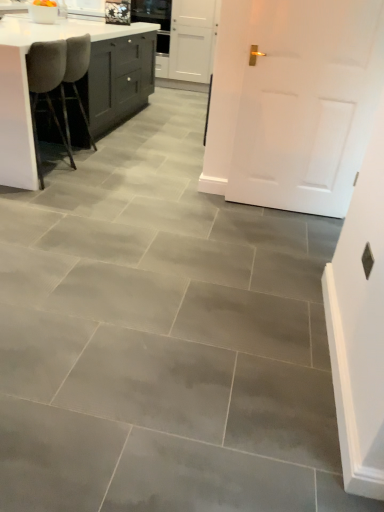
Question: Could you tell me if white matte door at center is turned towards white glossy countertop at upper left?

Choices:
 (A) no
 (B) yes

Answer: (A)

Question: Considering the relative sizes of white matte door at center and white glossy countertop at upper left in the image provided, is white matte door at center taller than white glossy countertop at upper left?

Choices:
 (A) no
 (B) yes

Answer: (B)

Question: Is white matte door at center directly adjacent to white glossy countertop at upper left?

Choices:
 (A) yes
 (B) no

Answer: (B)

Question: Is the depth of white matte door at center greater than that of white glossy countertop at upper left?

Choices:
 (A) yes
 (B) no

Answer: (B)

Question: Can you confirm if white matte door at center is shorter than white glossy countertop at upper left?

Choices:
 (A) yes
 (B) no

Answer: (B)

Question: Is gray fabric chair at left, positioned as the second chair in front-to-back order, spatially inside white glossy countertop at upper left, or outside of it?

Choices:
 (A) outside
 (B) inside

Answer: (B)

Question: Considering the positions of gray fabric chair at left, arranged as the 1th chair when viewed from the back, and white glossy countertop at upper left in the image, is gray fabric chair at left, arranged as the 1th chair when viewed from the back, wider or thinner than white glossy countertop at upper left?

Choices:
 (A) thin
 (B) wide

Answer: (A)

Question: Visually, is gray fabric chair at left, arranged as the 1th chair when viewed from the back, positioned to the left or to the right of white glossy countertop at upper left?

Choices:
 (A) right
 (B) left

Answer: (A)

Question: Considering the positions of point (49, 116) and point (6, 31), is point (49, 116) closer or farther from the camera than point (6, 31)?

Choices:
 (A) farther
 (B) closer

Answer: (A)

Question: Relative to white glossy countertop at upper left, is white matte door at center in front or behind?

Choices:
 (A) behind
 (B) front

Answer: (B)

Question: From the image's perspective, is white matte door at center above or below white glossy countertop at upper left?

Choices:
 (A) below
 (B) above

Answer: (A)

Question: Does point (263, 173) appear closer or farther from the camera than point (1, 154)?

Choices:
 (A) farther
 (B) closer

Answer: (A)

Question: Looking at their shapes, would you say white matte door at center is wider or thinner than white glossy countertop at upper left?

Choices:
 (A) wide
 (B) thin

Answer: (B)

Question: Is point (302, 10) positioned closer to the camera than point (72, 126)?

Choices:
 (A) farther
 (B) closer

Answer: (B)

Question: Would you say white matte door at center is to the left or to the right of gray fabric chair at left, arranged as the 1th chair when viewed from the back, in the picture?

Choices:
 (A) left
 (B) right

Answer: (B)